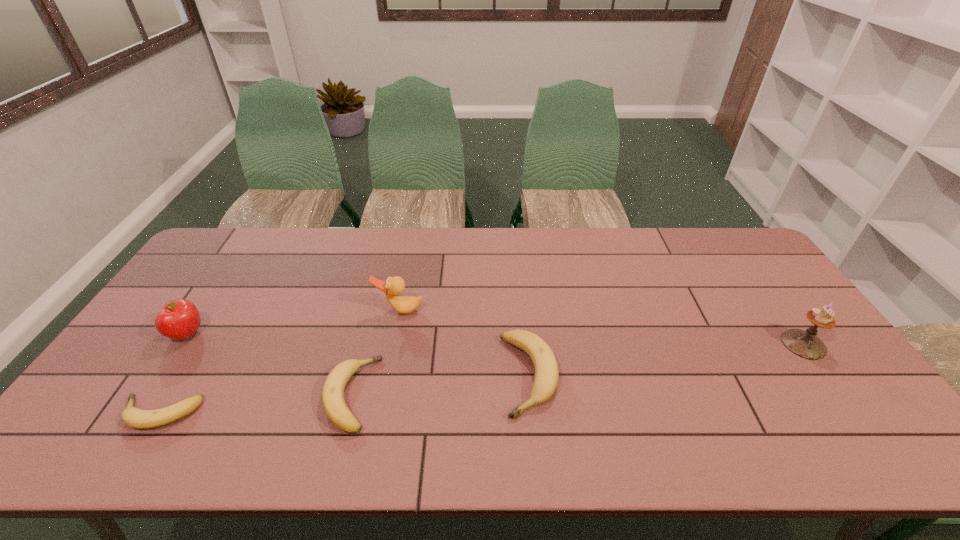
Identify the location of unoccupied position between the shortest object and the duck. (279, 362).

Locate an element on the screen. vacant area that lies between the shortest object and the candle holder is located at coordinates (481, 379).

I want to click on free spot between the apple and the leftmost banana, so click(173, 374).

Where is `vacant point located between the apple and the second object from right to left`? The height and width of the screenshot is (540, 960). vacant point located between the apple and the second object from right to left is located at coordinates coord(358,354).

The height and width of the screenshot is (540, 960). Identify the location of free spot between the second banana from right to left and the fifth object from left to right. pyautogui.click(x=440, y=384).

Point out which object is positioned as the nearest to the leftmost banana. Please provide its 2D coordinates. Your answer should be formatted as a tuple, i.e. [(x, y)], where the tuple contains the x and y coordinates of a point satisfying the conditions above.

[(179, 319)]

Select which object is the third closest to the fifth tallest object. Please provide its 2D coordinates. Your answer should be formatted as a tuple, i.e. [(x, y)], where the tuple contains the x and y coordinates of a point satisfying the conditions above.

[(545, 382)]

This screenshot has height=540, width=960. What are the coordinates of `the second closest banana relative to the shortest object` in the screenshot? It's located at (545, 382).

Locate an element on the screen. This screenshot has height=540, width=960. banana that is the second closest to the fifth object from left to right is located at coordinates (134, 417).

You are a GUI agent. You are given a task and a screenshot of the screen. Output one action in this format:
    pyautogui.click(x=<x>, y=<y>)
    Task: Click on the free point that satisfies the following two spatial constraints: 1. on the back side of the second object from right to left; 2. on the left side of the shortest object
    This screenshot has height=540, width=960.
    Given the screenshot: What is the action you would take?
    pyautogui.click(x=183, y=375)